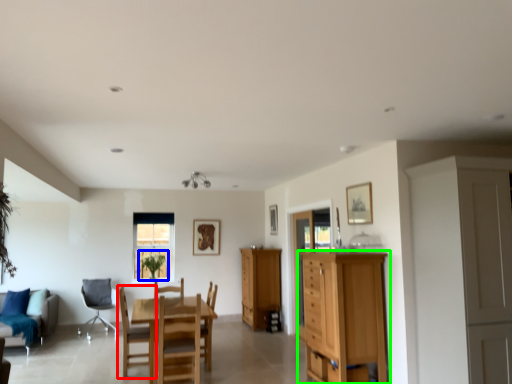
Question: Estimate the real-world distances between objects in this image. Which object is closer to chair (highlighted by a red box), plant (highlighted by a blue box) or chest of drawers (highlighted by a green box)?

Choices:
 (A) plant
 (B) chest of drawers

Answer: (B)